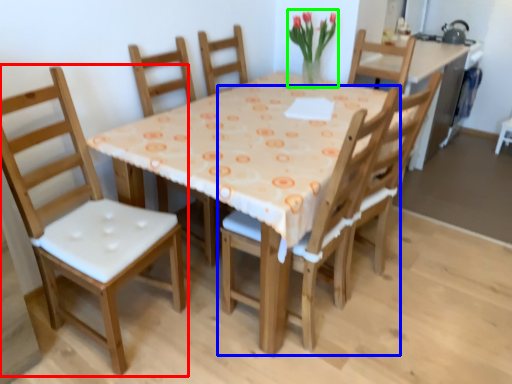
Question: Considering the real-world distances, which object is farthest from chair (highlighted by a red box)? chair (highlighted by a blue box) or floral arrangement (highlighted by a green box)?

Choices:
 (A) chair
 (B) floral arrangement

Answer: (B)